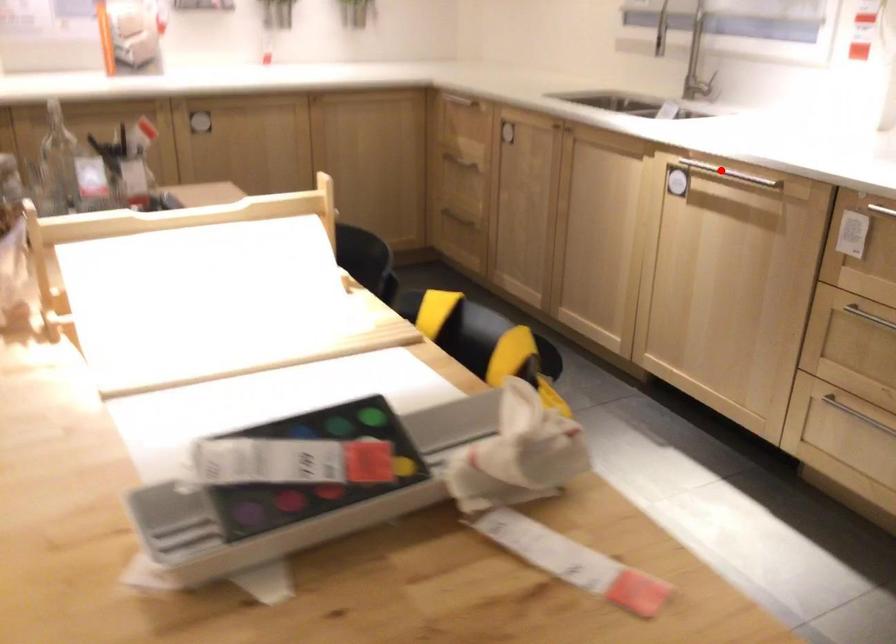
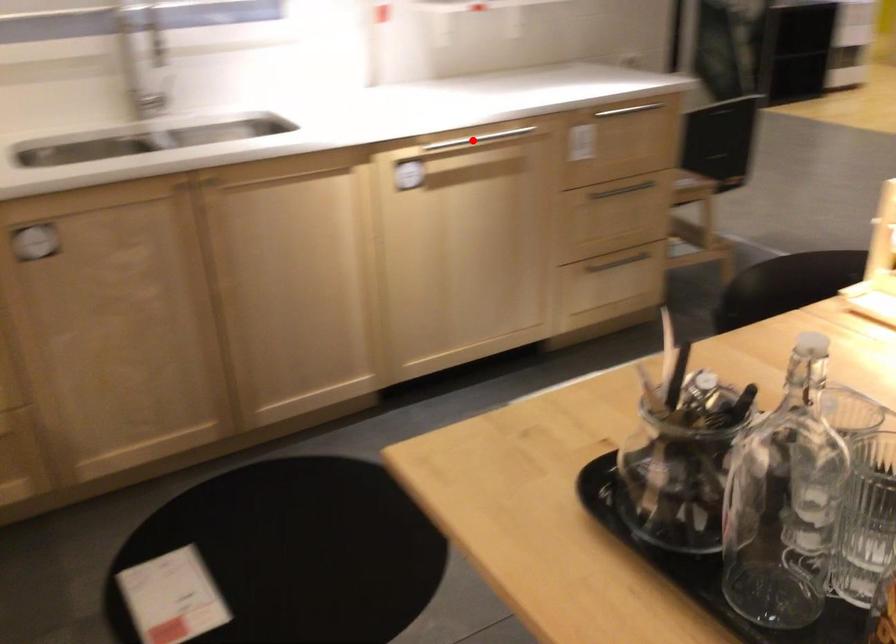
I am providing you with two images of the same scene from different viewpoints. A red point is marked on the first image and another point is marked on the second image. Are the points marked in image1 and image2 representing the same 3D position?

Yes